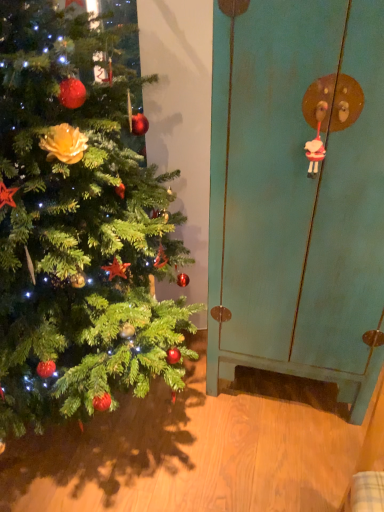
This screenshot has height=512, width=384. Find the location of `vacant region below teal matte cabinet at right (from a real-world perspective)`. vacant region below teal matte cabinet at right (from a real-world perspective) is located at coordinates (278, 392).